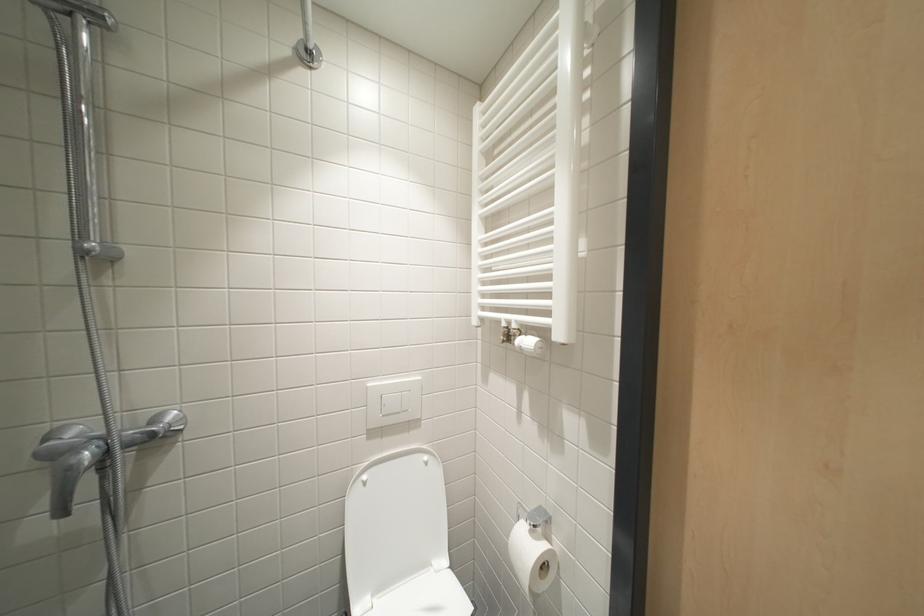
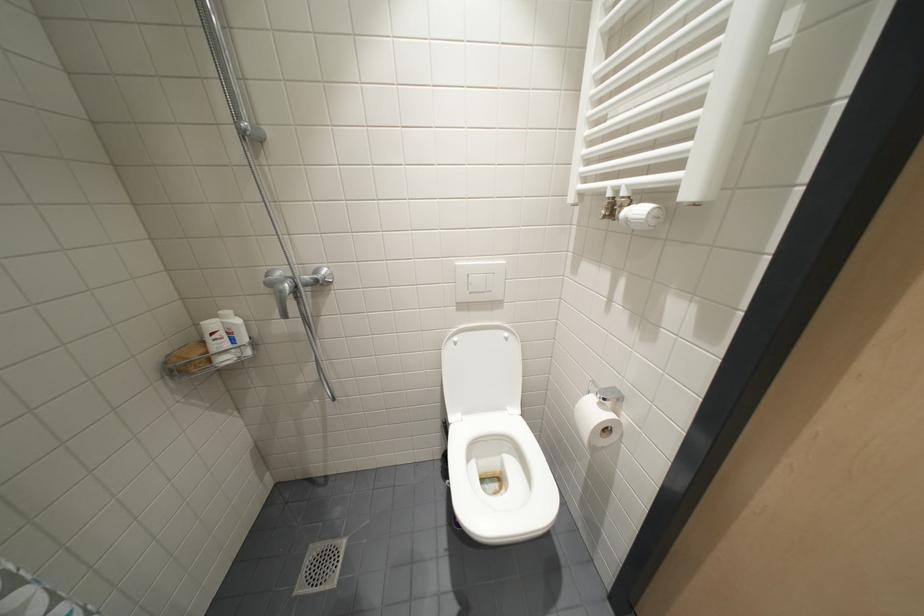
How did the camera likely rotate?

The rotation direction of the camera is left-down.